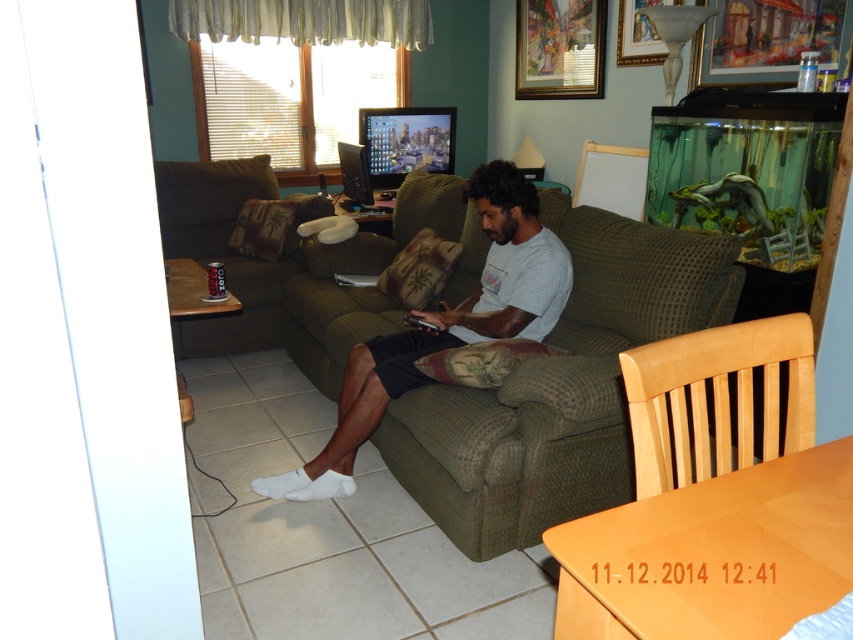
Question: Considering the relative positions of light brown wooden chair at lower right and green fabric couch at left in the image provided, where is light brown wooden chair at lower right located with respect to green fabric couch at left?

Choices:
 (A) left
 (B) right

Answer: (B)

Question: Is matte gray shirt at center to the left of light brown wooden chair at lower right from the viewer's perspective?

Choices:
 (A) no
 (B) yes

Answer: (B)

Question: Which point is closer to the camera?

Choices:
 (A) light brown wooden chair at lower right
 (B) matte gray shirt at center
 (C) green fabric couch at center
 (D) green fabric couch at left

Answer: (A)

Question: Among these points, which one is farthest from the camera?

Choices:
 (A) (274, 292)
 (B) (701, 417)

Answer: (A)

Question: Is green fabric couch at center in front of matte gray shirt at center?

Choices:
 (A) no
 (B) yes

Answer: (B)

Question: Which object is the farthest from the matte gray shirt at center?

Choices:
 (A) green fabric couch at left
 (B) light brown wooden chair at lower right
 (C) green fabric couch at center

Answer: (A)